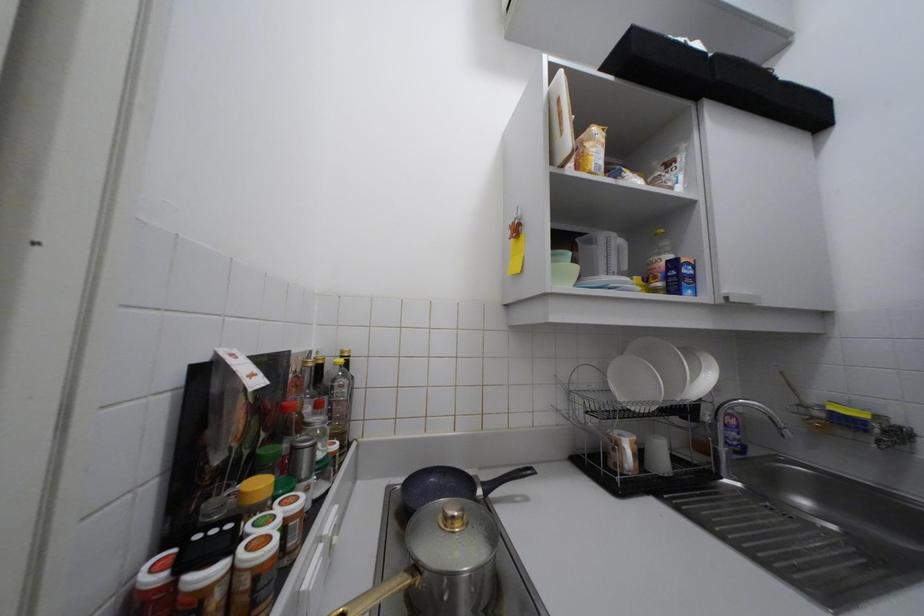
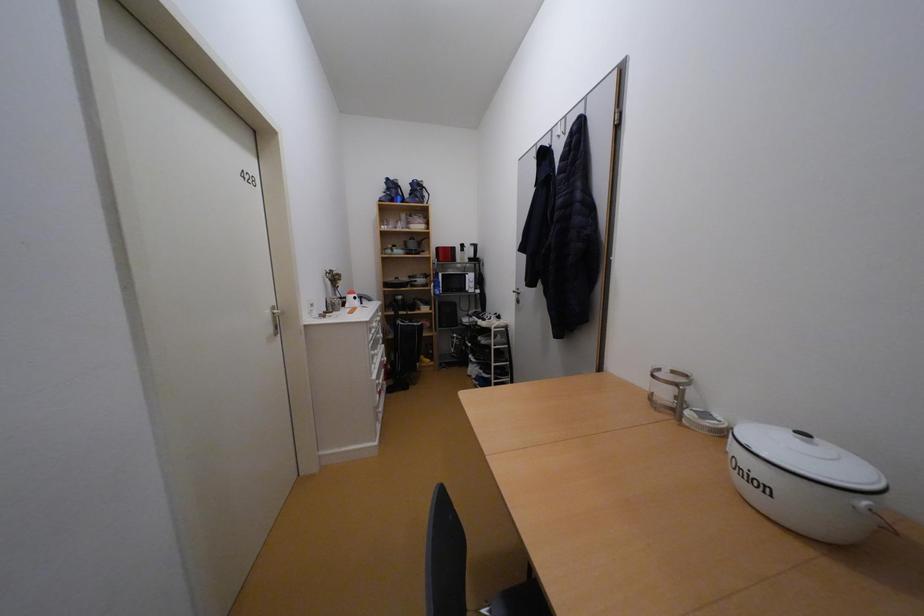
Question: The first image is from the beginning of the video and the second image is from the end. How did the camera likely rotate when shooting the video?

Choices:
 (A) Left
 (B) Right
 (C) Up
 (D) Down

Answer: (A)